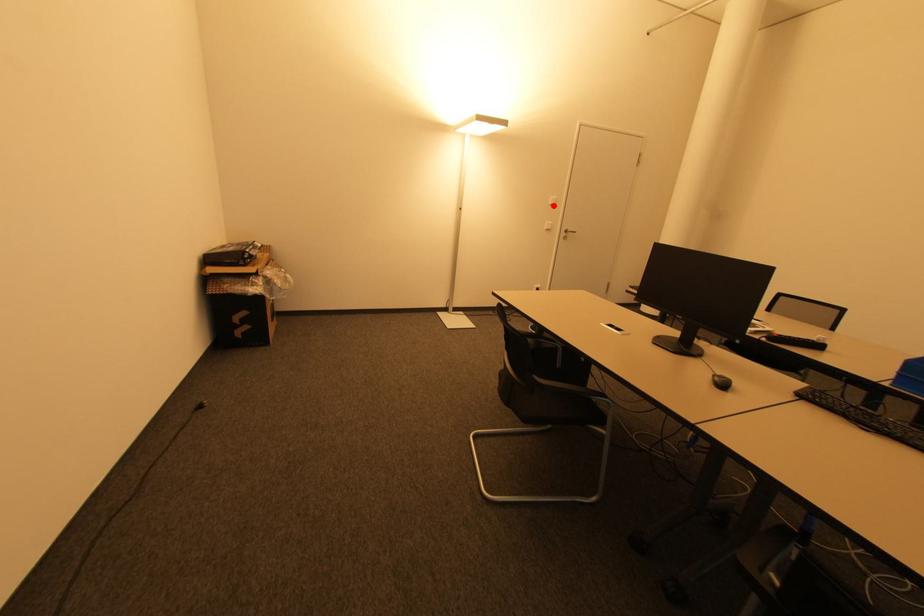
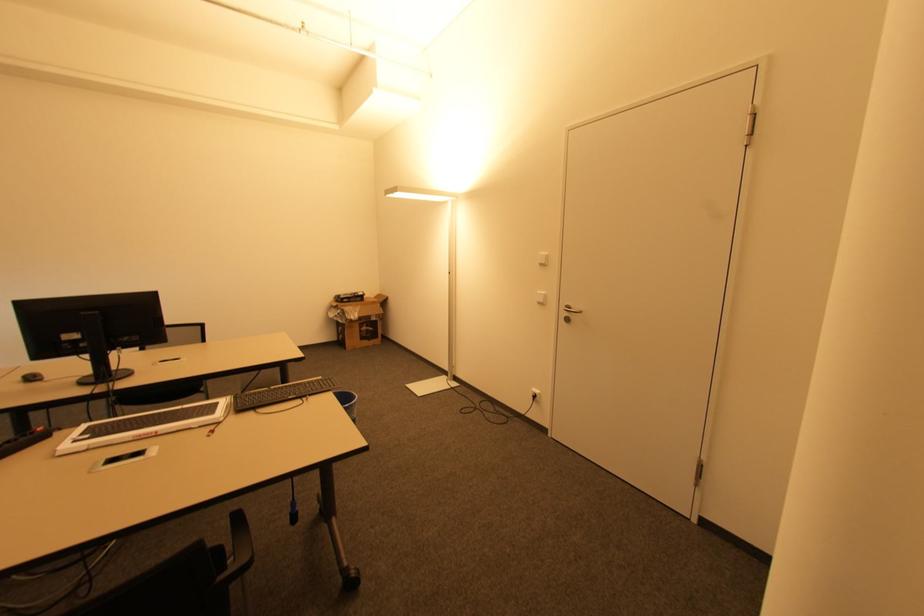
Locate, in the second image, the point that corresponds to the highlighted location in the first image.

(542, 265)